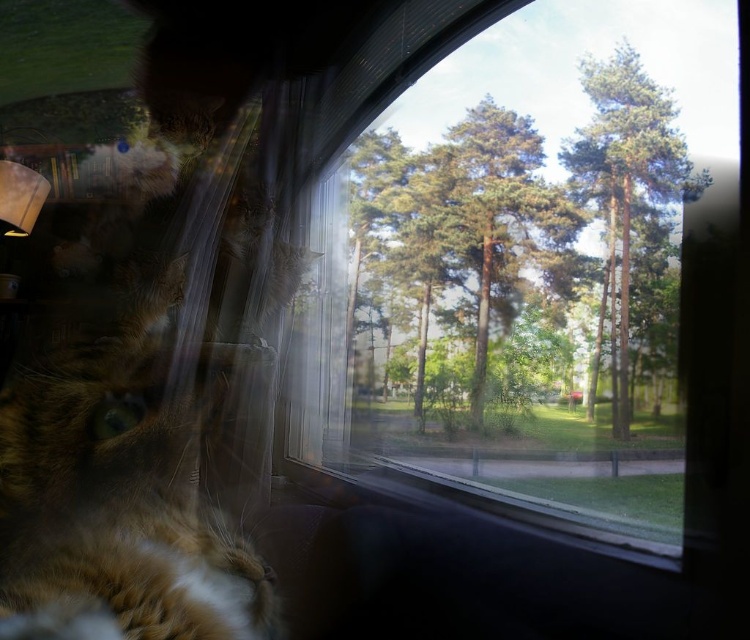
Is tabby fur cat at left further to camera compared to green leafy tree at upper right?

That is False.

From the picture: Does tabby fur cat at left appear over green leafy tree at upper right?

Actually, tabby fur cat at left is below green leafy tree at upper right.

Which is in front, point (192, 596) or point (636, 108)?

Point (192, 596) is more forward.

This screenshot has height=640, width=750. What are the coordinates of `tabby fur cat at left` in the screenshot? It's located at (123, 490).

Can you confirm if transparent glass window at center is positioned below green leafy tree at upper right?

Indeed, transparent glass window at center is positioned under green leafy tree at upper right.

Consider the image. Does transparent glass window at center have a smaller size compared to green leafy tree at upper right?

Incorrect, transparent glass window at center is not smaller in size than green leafy tree at upper right.

Identify the location of transparent glass window at center. (526, 268).

Where is `transparent glass window at center`? This screenshot has width=750, height=640. transparent glass window at center is located at coordinates [x=526, y=268].

Is transparent glass window at center thinner than tabby fur cat at left?

No, transparent glass window at center is not thinner than tabby fur cat at left.

From the picture: Which is more to the right, transparent glass window at center or tabby fur cat at left?

From the viewer's perspective, transparent glass window at center appears more on the right side.

This screenshot has height=640, width=750. Identify the location of transparent glass window at center. (526, 268).